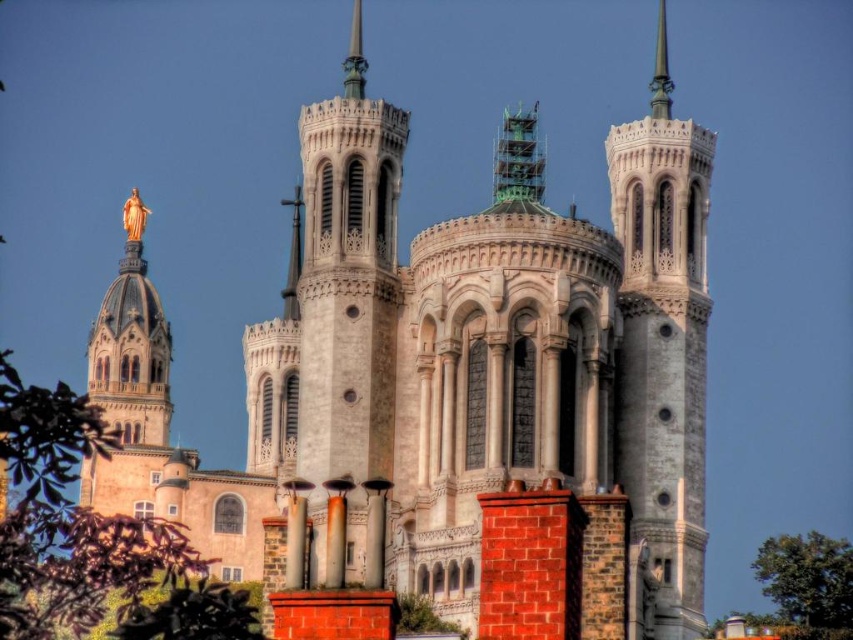
Question: Which object is farther from the camera taking this photo?

Choices:
 (A) polished silver spire at upper right
 (B) green leafy tree at lower right
 (C) white stone spire at center
 (D) polished bronze spire at center

Answer: (B)

Question: Is white stone spire at center to the left of polished bronze spire at center from the viewer's perspective?

Choices:
 (A) yes
 (B) no

Answer: (B)

Question: Does green leafy tree at lower right have a larger size compared to polished silver spire at upper right?

Choices:
 (A) yes
 (B) no

Answer: (A)

Question: Does white stone spire at center have a larger size compared to polished silver spire at upper right?

Choices:
 (A) no
 (B) yes

Answer: (A)

Question: Which point is closer to the camera taking this photo?

Choices:
 (A) (671, 285)
 (B) (654, 65)
 (C) (351, 29)

Answer: (A)

Question: Which of the following is the farthest from the observer?

Choices:
 (A) (354, 28)
 (B) (780, 541)

Answer: (B)